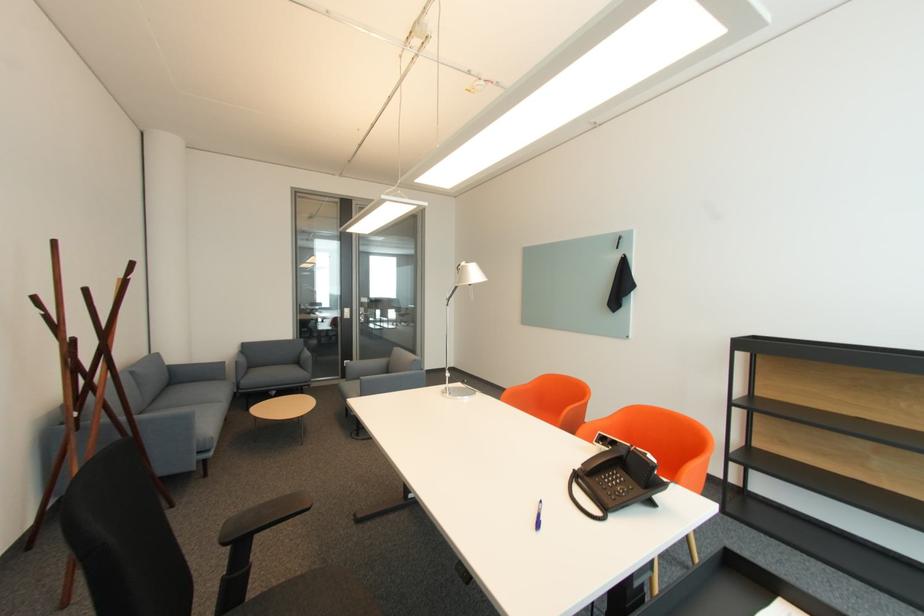
Where is `silver lamp head`? The width and height of the screenshot is (924, 616). silver lamp head is located at coordinates (468, 274).